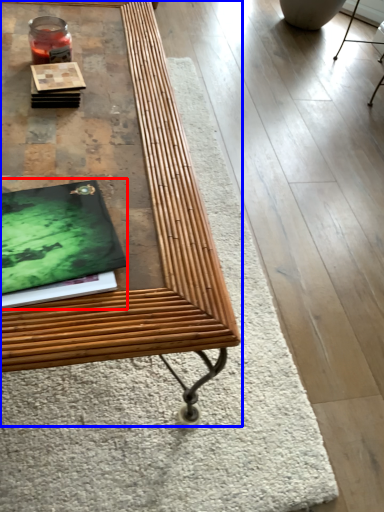
Question: Which point is closer to the camera, magazine (highlighted by a red box) or table (highlighted by a blue box)?

Choices:
 (A) magazine
 (B) table

Answer: (B)